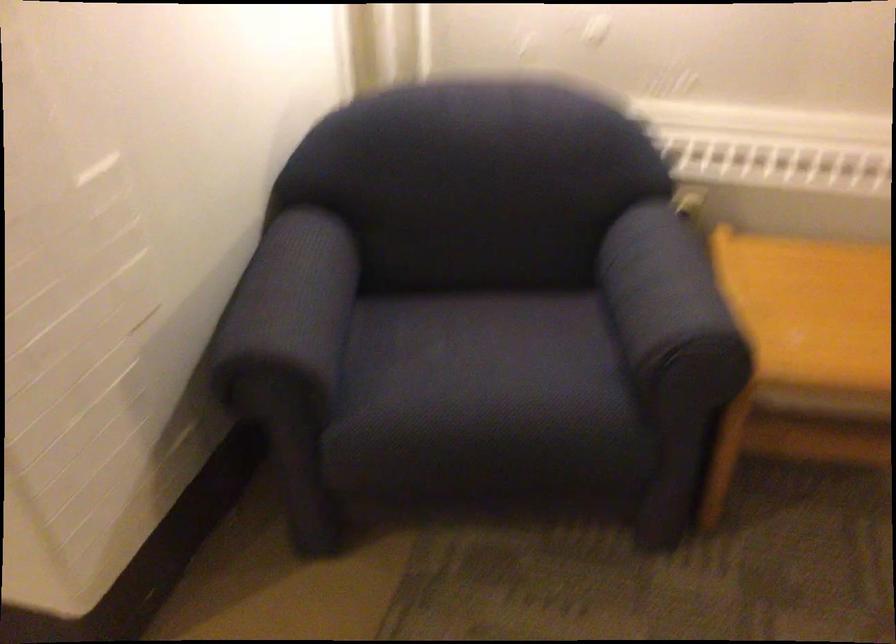
The height and width of the screenshot is (644, 896). What are the coordinates of `blue chair sitting surface` in the screenshot? It's located at (485, 366).